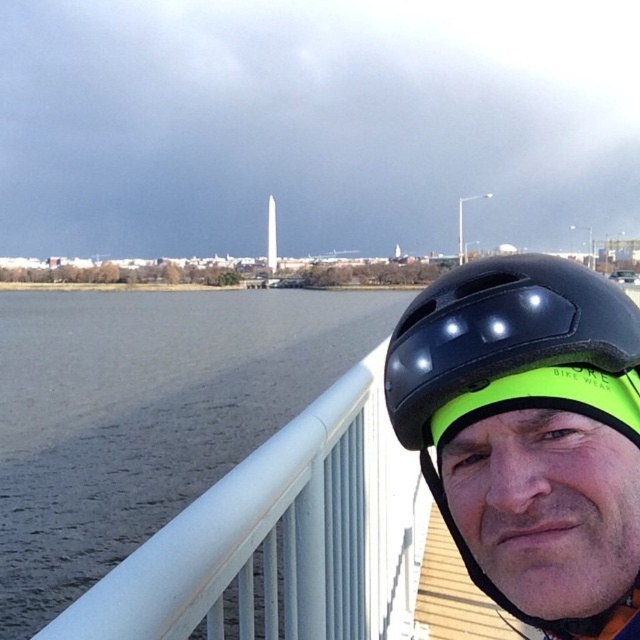
You are a photographer trying to capture the entire scene in one shot. Given that the gray matte water at left and the black matte helmet at upper right are both in your frame, which object would require more horizontal space in your photo?

The gray matte water at left requires more horizontal space in the photo because its width surpasses that of the black matte helmet at upper right.